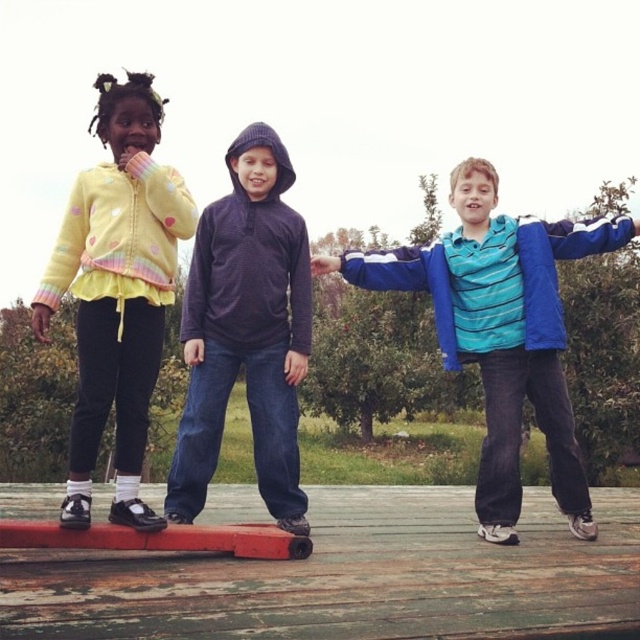
You are a photographer trying to capture a group photo of the blue striped shirt at center and the yellow fleece jacket at left. The camera you are using has a maximum focus range of 2 meters. Will both subjects be in focus if you position yourself exactly between them?

The blue striped shirt at center is 1.91 meters from the yellow fleece jacket at left. Since the camera can focus up to 2 meters, positioning yourself between them would mean each subject is about 0.955 meters away from the camera. This distance is within the focus range, so both will be in focus.

You are a parent trying to ensure your child stays safe while playing on the wooden platform. You notice the wooden plank at center and the blue striped shirt at center. Which object is positioned lower in the scene?

The wooden plank at center is located below the blue striped shirt at center, so it is positioned lower in the scene.